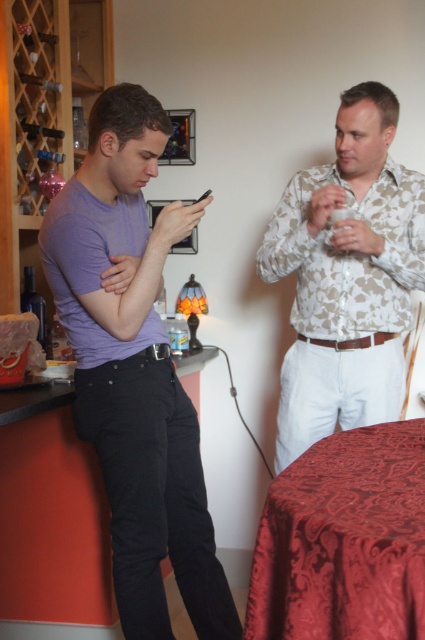
Question: Which object is the closest to the smooth glossy table at lower center?

Choices:
 (A) velvet-like red tablecloth at lower right
 (B) purple matte shirt at left

Answer: (B)

Question: Which point is closer to the camera?

Choices:
 (A) (368, 344)
 (B) (30, 412)

Answer: (B)

Question: Is purple matte shirt at left positioned in front of velvet-like red tablecloth at lower right?

Choices:
 (A) no
 (B) yes

Answer: (A)

Question: Is white floral shirt at upper center positioned before velvet-like red tablecloth at lower right?

Choices:
 (A) yes
 (B) no

Answer: (B)

Question: Which of the following is the farthest from the observer?

Choices:
 (A) velvet-like red tablecloth at lower right
 (B) smooth glossy table at lower center
 (C) white floral shirt at upper center

Answer: (C)

Question: From the image, what is the correct spatial relationship of purple matte shirt at left in relation to smooth glossy table at lower center?

Choices:
 (A) left
 (B) right

Answer: (B)